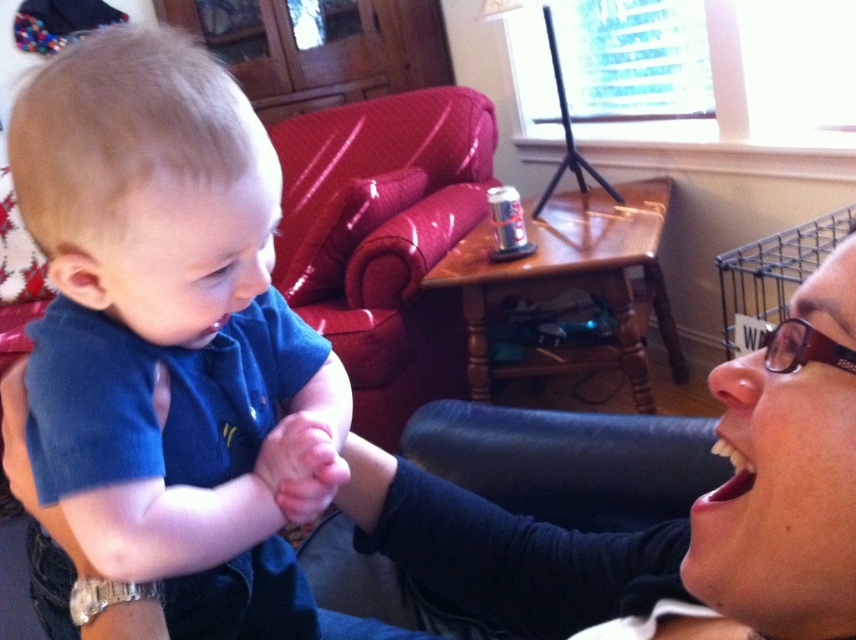
Question: Can you confirm if blue soft fabric baby at center is positioned to the right of matte black shirt at lower right?

Choices:
 (A) yes
 (B) no

Answer: (B)

Question: Which of these objects is positioned closest to the blue soft fabric baby at center?

Choices:
 (A) matte black glasses at lower right
 (B) matte black shirt at lower right

Answer: (B)

Question: Does matte black shirt at lower right lie in front of matte black glasses at lower right?

Choices:
 (A) no
 (B) yes

Answer: (A)

Question: Which object is farther from the camera taking this photo?

Choices:
 (A) matte black shirt at lower right
 (B) matte black glasses at lower right
 (C) blue soft fabric baby at center

Answer: (C)

Question: Based on their relative distances, which object is farther from the glossy vinyl armchair at upper center?

Choices:
 (A) blue soft fabric baby at center
 (B) smooth skin hand at center

Answer: (B)

Question: Is glossy vinyl armchair at upper center to the left of smooth skin hand at center from the viewer's perspective?

Choices:
 (A) no
 (B) yes

Answer: (B)